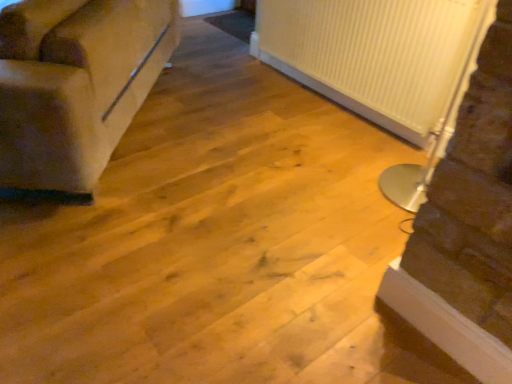
Locate an element on the screen. The image size is (512, 384). vacant space that is in between white ribbed radiator at right and white ribbed radiator at upper right is located at coordinates (316, 119).